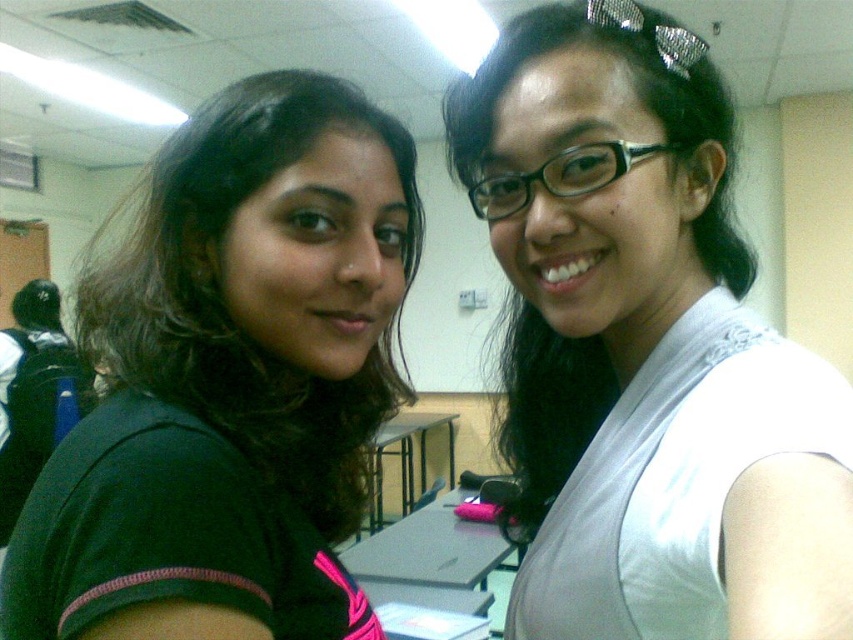
You are a photographer setting up a shot in a classroom. You need to ensure that the white matte vest at upper right and the dark green fabric shirt at upper left are both visible in the frame. Given their positions and sizes, which of these two items should you focus on first to ensure they are both in the frame?

The white matte vest at upper right is much taller than the dark green fabric shirt at upper left, so you should focus on ensuring the white matte vest at upper right is in the frame first since its larger size may require more space to be fully captured.

You are a photographer setting up for a group photo. You need to ensure that the white matte vest at upper right and the dark green fabric shirt at upper left are at least 6 inches apart to avoid overlapping in the frame. Based on the scene described, can you confirm if they meet this requirement?

The distance between the white matte vest at upper right and the dark green fabric shirt at upper left is 7.22 inches, which exceeds the required 6 inches. Therefore, they are sufficiently spaced to avoid overlapping in the frame.

Consider the image. You are a photographer setting up for a group photo. You notice two people wearing the white matte vest at upper right and the dark green fabric shirt at upper left. Which clothing item has a narrower width at the shoulder area?

The white matte vest at upper right is thinner than the dark green fabric shirt at upper left, so the white matte vest at upper right has a narrower width at the shoulder area.